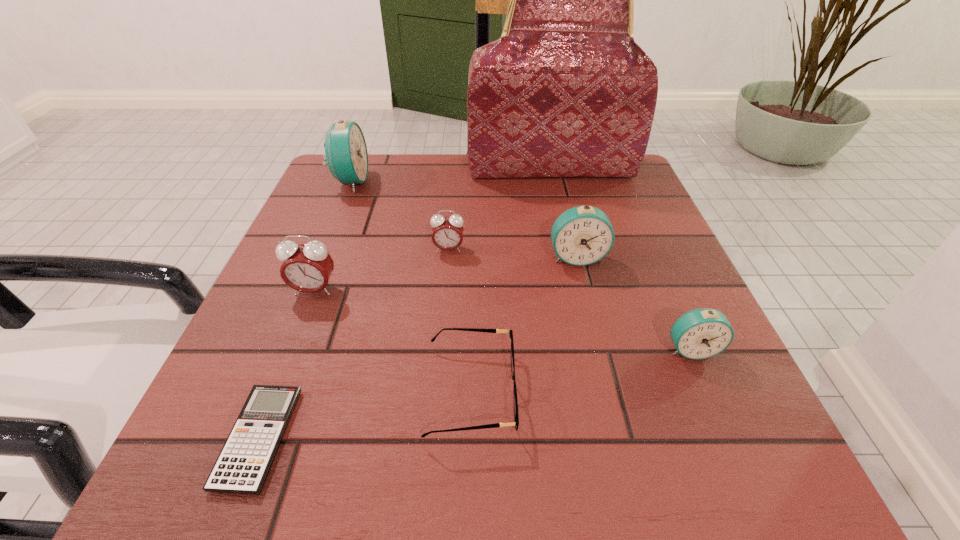
This screenshot has height=540, width=960. I want to click on vacant space located on the back of the shortest object, so click(x=303, y=322).

Identify the location of handbag that is at the far edge. Image resolution: width=960 pixels, height=540 pixels. (565, 91).

You are a GUI agent. You are given a task and a screenshot of the screen. Output one action in this format:
    pyautogui.click(x=<x>, y=<y>)
    Task: Click on the alarm clock that is at the far edge
    The image size is (960, 540).
    Given the screenshot: What is the action you would take?
    pyautogui.click(x=346, y=154)

At what (x,y) coordinates should I click in order to perform the action: click on spectacles at the near edge. Please return your answer as a coordinate pair (x, y). Looking at the image, I should click on (516, 417).

Where is `calculator present at the near edge`? The image size is (960, 540). calculator present at the near edge is located at coordinates (244, 462).

At what (x,y) coordinates should I click in order to perform the action: click on calculator that is at the left edge. Please return your answer as a coordinate pair (x, y). This screenshot has width=960, height=540. Looking at the image, I should click on (244, 462).

Where is `handbag located at the right edge`? Image resolution: width=960 pixels, height=540 pixels. handbag located at the right edge is located at coordinates (565, 91).

This screenshot has width=960, height=540. Identify the location of object that is at the far left corner. (346, 154).

You are a GUI agent. You are given a task and a screenshot of the screen. Output one action in this format:
    pyautogui.click(x=<x>, y=<y>)
    Task: Click on the object at the near left corner
    Image resolution: width=960 pixels, height=540 pixels.
    Given the screenshot: What is the action you would take?
    pyautogui.click(x=244, y=462)

You are a GUI agent. You are given a task and a screenshot of the screen. Output one action in this format:
    pyautogui.click(x=<x>, y=<y>)
    Task: Click on the object present at the far right corner
    The height and width of the screenshot is (540, 960).
    Given the screenshot: What is the action you would take?
    pyautogui.click(x=565, y=91)